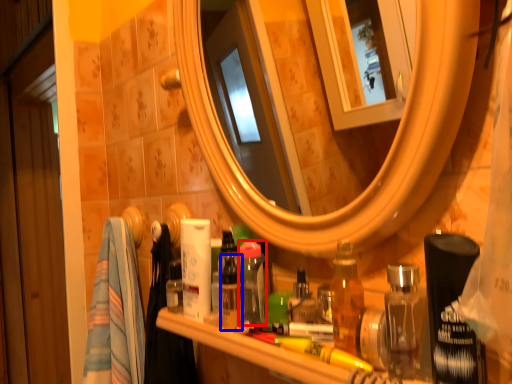
Question: Which of the following is the closest to the observer, toiletry (highlighted by a red box) or toiletry (highlighted by a blue box)?

Choices:
 (A) toiletry
 (B) toiletry

Answer: (B)